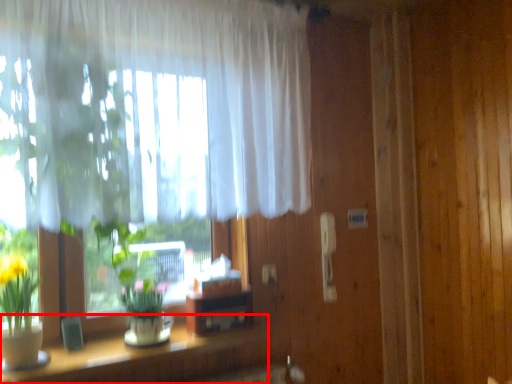
Question: In this image, where is table (annotated by the red box) located relative to curtain?

Choices:
 (A) right
 (B) left

Answer: (B)